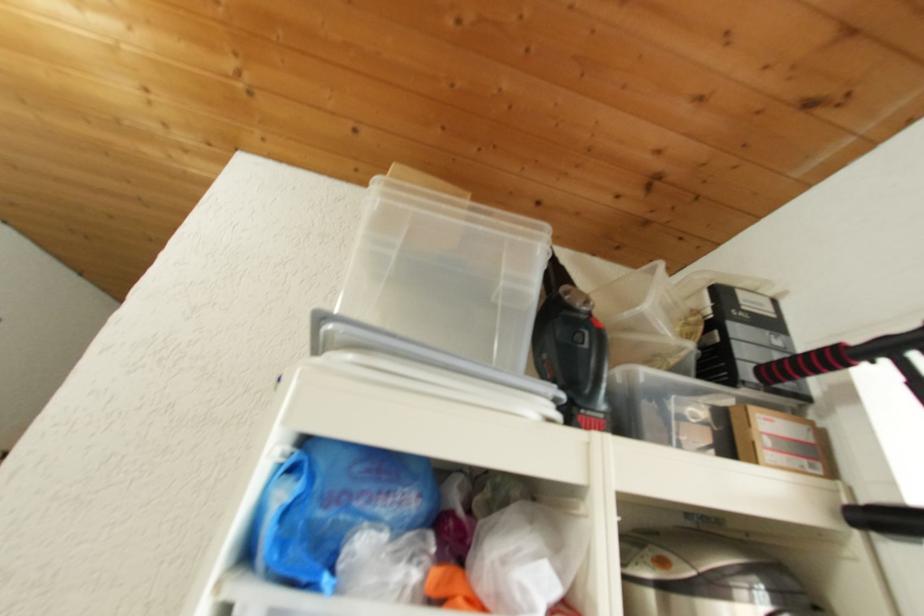
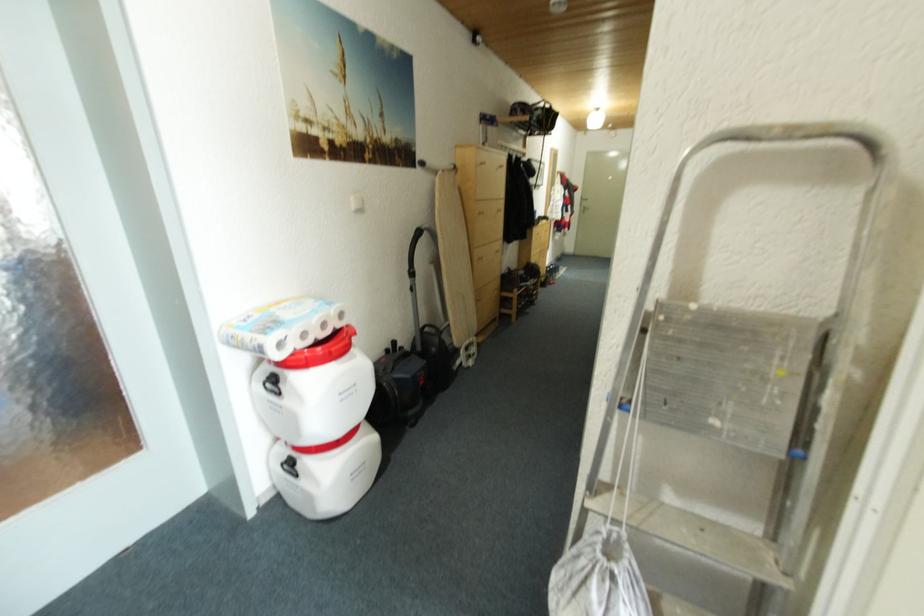
Based on the continuous images, in which direction is the camera rotating?

The rotation direction of the camera is left-down.